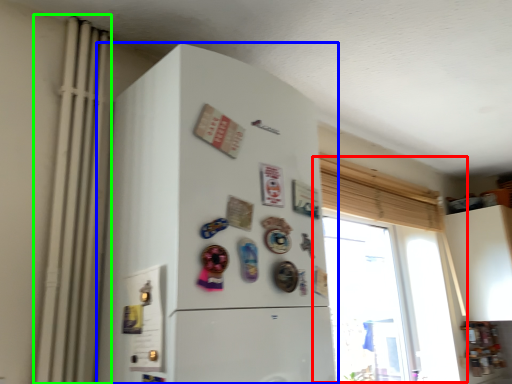
Question: Based on their relative distances, which object is nearer to window (highlighted by a red box)? Choose from refrigerator (highlighted by a blue box) and radiator (highlighted by a green box).

Choices:
 (A) refrigerator
 (B) radiator

Answer: (A)